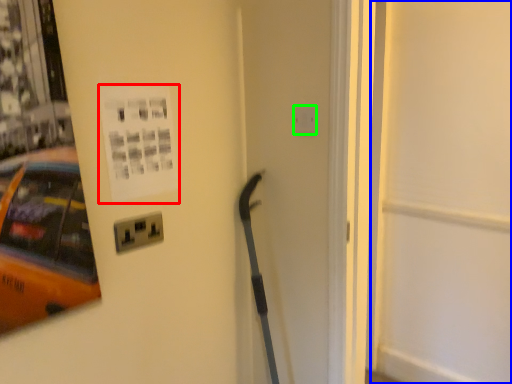
Question: Considering the real-world distances, which object is farthest from poster page (highlighted by a red box)? door (highlighted by a blue box) or electric outlet (highlighted by a green box)?

Choices:
 (A) door
 (B) electric outlet

Answer: (A)